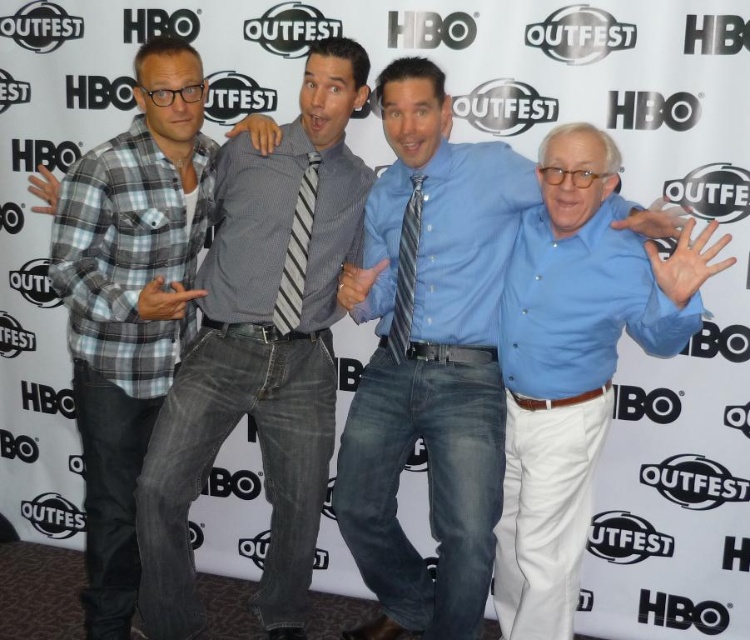
Between plaid flannel shirt at left and gray striped tie at center, which one has more height?

plaid flannel shirt at left is taller.

Which of these two, plaid flannel shirt at left or gray striped tie at center, stands shorter?

gray striped tie at center

What are the coordinates of `plaid flannel shirt at left` in the screenshot? It's located at (129, 301).

Does blue striped tie at center have a greater height compared to gray plaid shirt at center?

In fact, blue striped tie at center may be shorter than gray plaid shirt at center.

Which is in front, point (464, 196) or point (216, 349)?

Point (464, 196) is in front.

Which is in front, point (375, 467) or point (180, 600)?

Point (180, 600) is more forward.

Where is `blue striped tie at center`? The height and width of the screenshot is (640, 750). blue striped tie at center is located at coordinates (429, 362).

From the picture: Can you confirm if light blue button-down shirt at right is positioned above gray striped tie at center?

No.

Does point (610, 275) come behind point (273, 307)?

No, it is not.

Where is `light blue button-down shirt at right`? The width and height of the screenshot is (750, 640). light blue button-down shirt at right is located at coordinates (574, 364).